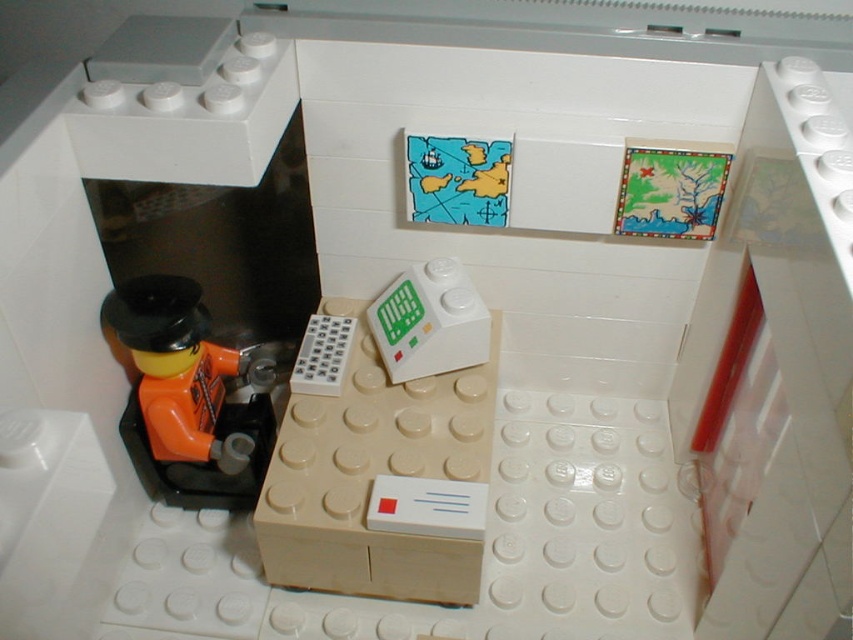
Question: Does orange matte figure at left have a larger size compared to white plastic remote at lower left?

Choices:
 (A) yes
 (B) no

Answer: (A)

Question: Which of the following is the farthest from the observer?

Choices:
 (A) beige plastic drawer at center
 (B) white plastic remote at lower left

Answer: (B)

Question: Is beige plastic drawer at center closer to camera compared to white plastic remote at lower left?

Choices:
 (A) no
 (B) yes

Answer: (B)

Question: Does orange matte figure at left appear on the right side of white plastic remote at lower left?

Choices:
 (A) no
 (B) yes

Answer: (A)

Question: Estimate the real-world distances between objects in this image. Which object is closer to the beige plastic drawer at center?

Choices:
 (A) orange matte figure at left
 (B) white plastic remote at lower left

Answer: (B)

Question: Estimate the real-world distances between objects in this image. Which object is farther from the beige plastic drawer at center?

Choices:
 (A) orange matte figure at left
 (B) white plastic remote at lower left

Answer: (A)